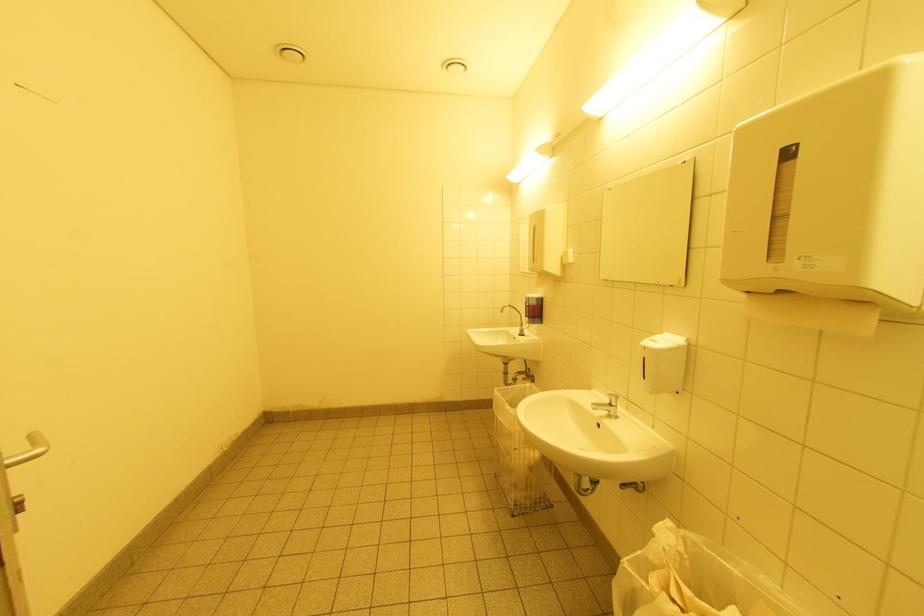
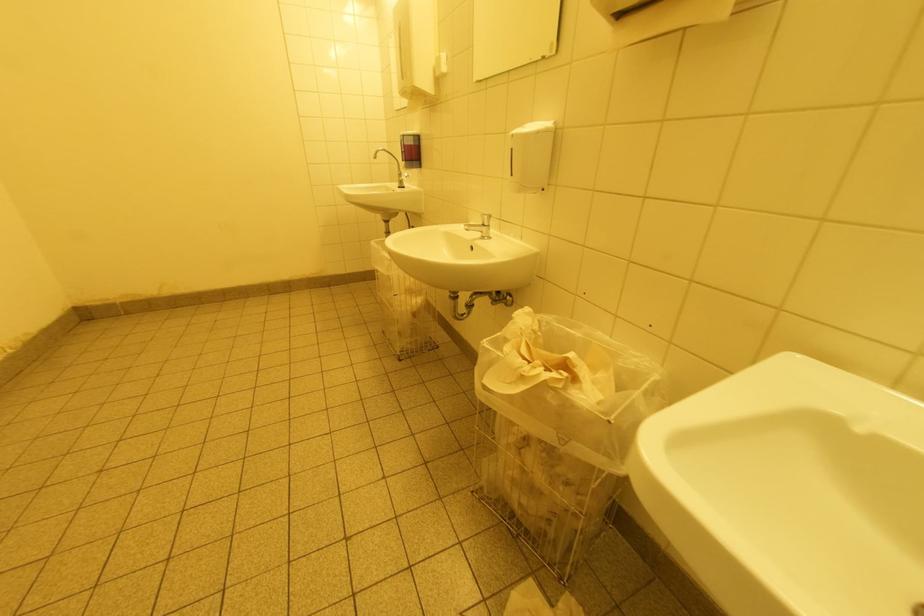
The images are taken continuously from a first-person perspective. In which direction are you moving?

The movement direction of the cameraman is right, forward.